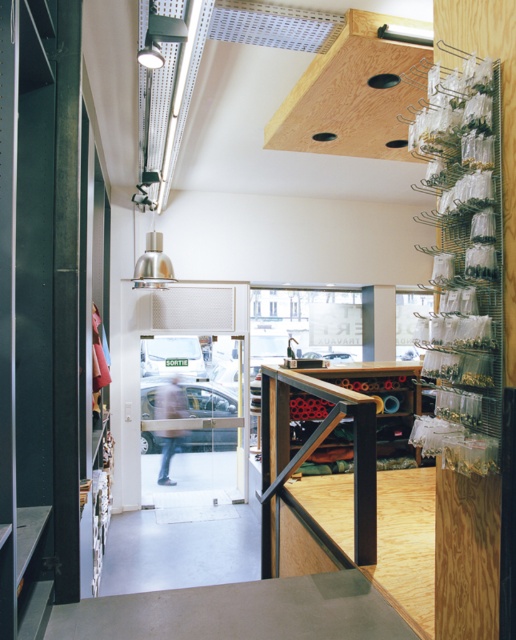
Does natural wood exhaust hood at upper center have a greater width compared to plywood counter at center?

In fact, natural wood exhaust hood at upper center might be narrower than plywood counter at center.

Does point (338, 128) come farther from viewer compared to point (393, 493)?

No, it is not.

Is point (343, 112) closer to viewer compared to point (375, 564)?

No, it is not.

Where is `natural wood exhaust hood at upper center`? The image size is (516, 640). natural wood exhaust hood at upper center is located at coordinates (351, 93).

Does point (114, 611) come closer to viewer compared to point (380, 122)?

Yes, point (114, 611) is closer to viewer.

Describe the element at coordinates (238, 611) in the screenshot. The image size is (516, 640). I see `smooth concrete counter top at center` at that location.

Is point (358, 596) positioned behind point (353, 147)?

No.

The width and height of the screenshot is (516, 640). I want to click on smooth concrete counter top at center, so [238, 611].

Which of these two, smooth concrete counter top at center or plywood counter at center, stands taller?

plywood counter at center is taller.

Who is more forward, (284, 577) or (388, 570)?

Point (284, 577) is more forward.

Locate an element on the screen. The height and width of the screenshot is (640, 516). smooth concrete counter top at center is located at coordinates tap(238, 611).